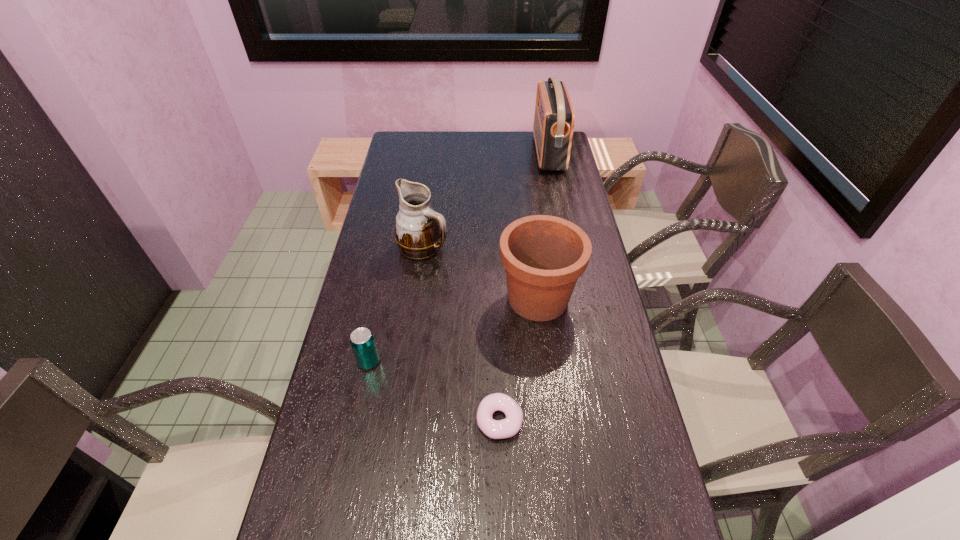
Where is `free space located 0.240m on the front-facing side of the farthest object`? The image size is (960, 540). free space located 0.240m on the front-facing side of the farthest object is located at coordinates (x=480, y=153).

The image size is (960, 540). What are the coordinates of `vacant space positioned from the spout of the pitcher` in the screenshot? It's located at (524, 247).

This screenshot has height=540, width=960. In order to click on free space located 0.400m on the front of the third farthest object in this screenshot , I will do `click(560, 477)`.

Locate an element on the screen. This screenshot has height=540, width=960. vacant space located on the right of the beer can is located at coordinates (463, 362).

In order to click on free space located on the right of the doughnut in this screenshot , I will do `click(581, 420)`.

The image size is (960, 540). I want to click on object present at the far edge, so click(554, 118).

This screenshot has width=960, height=540. In order to click on pitcher at the left edge in this screenshot , I will do `click(420, 232)`.

Identify the location of beer can at the left edge. This screenshot has width=960, height=540. (362, 341).

Locate an element on the screen. radio receiver that is at the right edge is located at coordinates pyautogui.click(x=554, y=118).

At what (x,y) coordinates should I click in order to perform the action: click on flowerpot that is at the right edge. Please return your answer as a coordinate pair (x, y). Looking at the image, I should click on (544, 256).